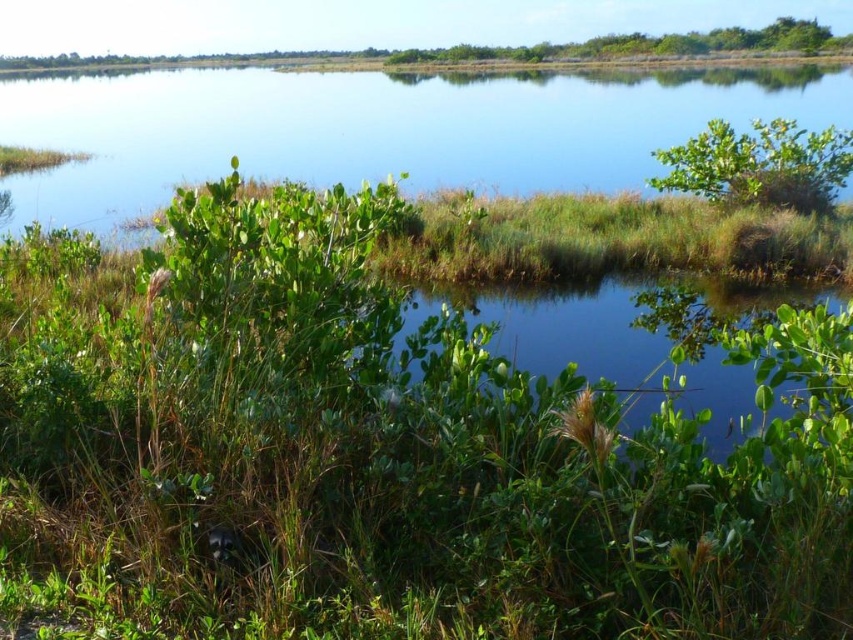
Where is `green grassy water at upper center`? This screenshot has height=640, width=853. green grassy water at upper center is located at coordinates (376, 131).

Measure the distance between point (706, 106) and camera.

Point (706, 106) is 46.52 meters away from camera.

Where is `green grassy water at upper center`? The height and width of the screenshot is (640, 853). green grassy water at upper center is located at coordinates (376, 131).